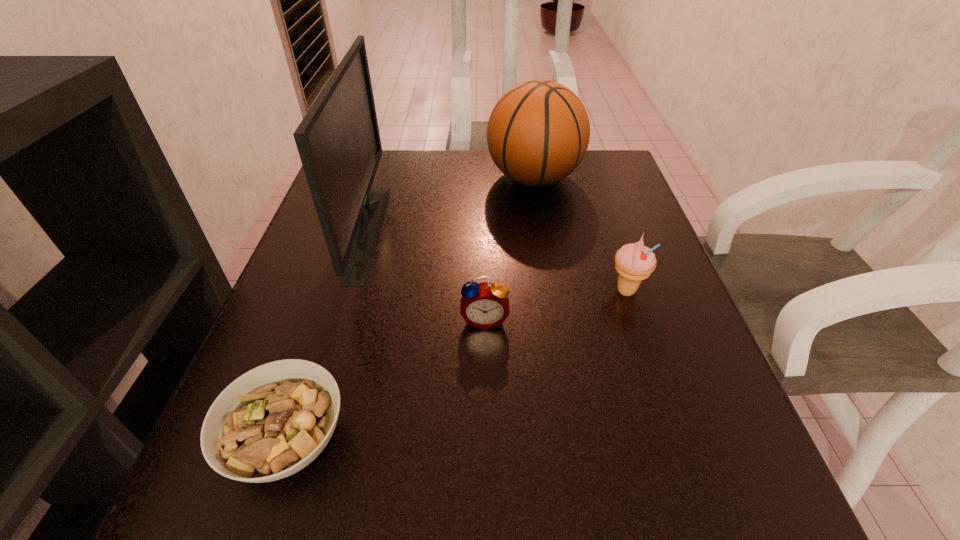
At what (x,y) coordinates should I click in order to perform the action: click on vacant area between the stew and the icecream. Please return your answer as a coordinate pair (x, y). Looking at the image, I should click on (458, 366).

Where is `free space between the icecream and the fourth shortest object`? free space between the icecream and the fourth shortest object is located at coordinates (580, 234).

You are a GUI agent. You are given a task and a screenshot of the screen. Output one action in this format:
    pyautogui.click(x=<x>, y=<y>)
    Task: Click on the vacant region between the fourth tallest object and the nearest object
    This screenshot has height=540, width=960.
    Given the screenshot: What is the action you would take?
    pyautogui.click(x=387, y=380)

The image size is (960, 540). Find the location of `vacant area that lies between the tallest object and the second tallest object`. vacant area that lies between the tallest object and the second tallest object is located at coordinates (451, 204).

Locate an element on the screen. The image size is (960, 540). free area in between the icecream and the monitor is located at coordinates (497, 261).

Find the location of a particular element. This screenshot has width=960, height=540. free area in between the icecream and the fourth tallest object is located at coordinates (555, 305).

What are the coordinates of `unoccupied position between the fourth shortest object and the icecream` in the screenshot? It's located at (580, 234).

Where is `vacant area that lies between the tallest object and the icecream`? vacant area that lies between the tallest object and the icecream is located at coordinates (497, 261).

This screenshot has height=540, width=960. In order to click on object that stands as the second closest to the second tallest object in this screenshot , I will do pos(634,262).

Find the location of a particular element. The width and height of the screenshot is (960, 540). object that is the third closest to the icecream is located at coordinates (338, 140).